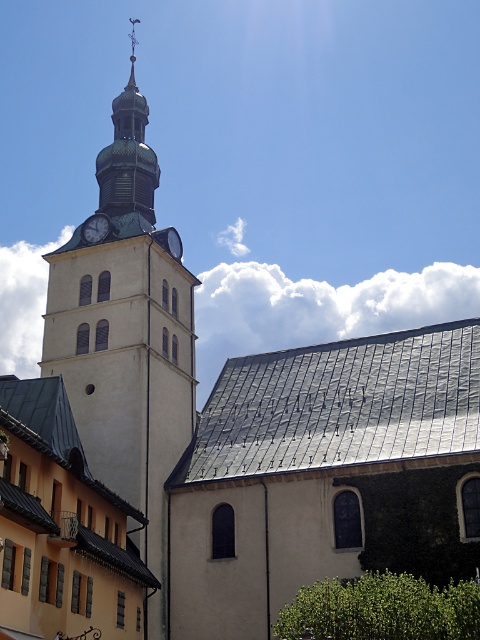
You are standing in front of the historic church and want to take a photo of the beige stone clock tower at center and the metallic silver clock at upper center. Which object should you focus on first if you want to capture both in a single frame without moving the camera?

You should focus on the beige stone clock tower at center first because it is closer to the viewer than the metallic silver clock at upper center. By focusing on the closer object, the background object will still be in acceptable focus due to depth of field, allowing both to be captured clearly in the same frame.

You are an architect inspecting the church from the ground. You notice two clocks on the bell tower. Which clock has a bigger face, the matte gray clock at upper left or the metallic silver clock at upper center?

The matte gray clock at upper left is larger in size than the metallic silver clock at upper center, so the matte gray clock at upper left has a bigger face.

You are standing at the entrance of the historic church and want to take a photo of the beige stone clock tower at center. According to the coordinates provided, where should you position yourself to capture the clock tower in the frame?

The beige stone clock tower at center is located at coordinates point [127,340], so you should position yourself facing the center of the image to capture it in the frame.